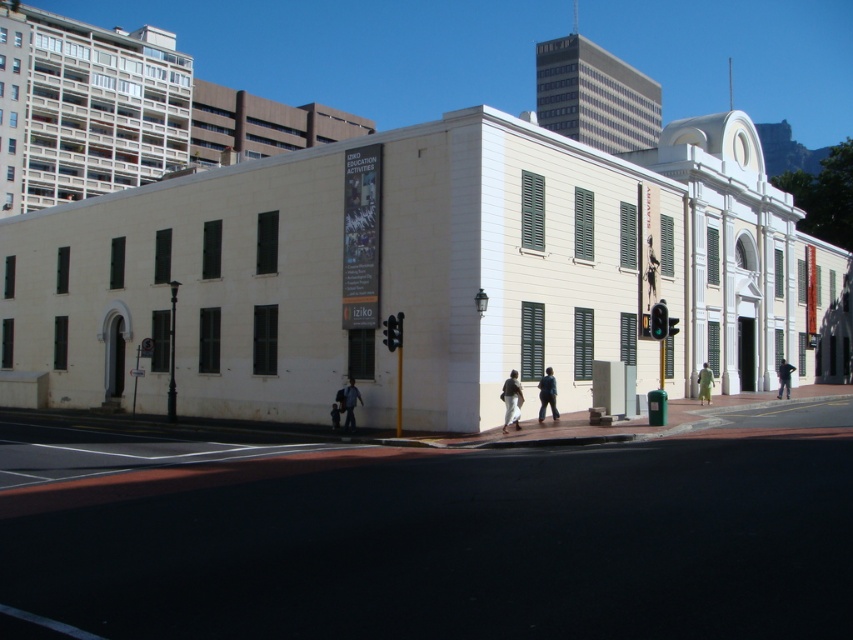
Is brown leather jacket at center further to camera compared to light blue fabric at center?

No, it is not.

Which is behind, point (514, 406) or point (334, 406)?

The point (334, 406) is behind.

What are the coordinates of `brown leather jacket at center` in the screenshot? It's located at (511, 401).

What do you see at coordinates (704, 384) in the screenshot? I see `green fabric dress at lower right` at bounding box center [704, 384].

Does green fabric dress at lower right have a lesser height compared to dark blue jeans at lower right?

Yes.

Locate an element on the screen. The width and height of the screenshot is (853, 640). green fabric dress at lower right is located at coordinates (704, 384).

At what (x,y) coordinates should I click in order to perform the action: click on green fabric dress at lower right. Please return your answer as a coordinate pair (x, y). The image size is (853, 640). Looking at the image, I should click on (704, 384).

Does brown leather jacket at center come in front of green fabric dress at lower right?

Yes, it is.

Which is more to the right, brown leather jacket at center or green fabric dress at lower right?

Positioned to the right is green fabric dress at lower right.

At what (x,y) coordinates should I click in order to perform the action: click on brown leather jacket at center. Please return your answer as a coordinate pair (x, y). Looking at the image, I should click on 511,401.